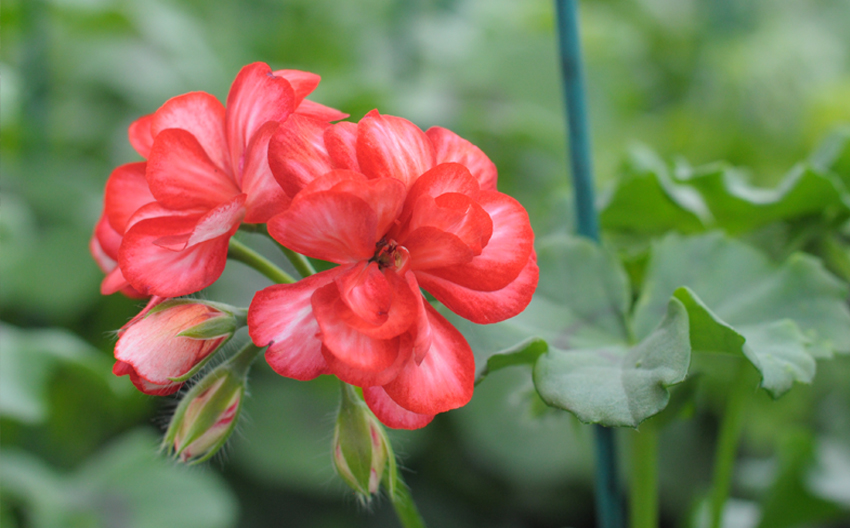
Image resolution: width=850 pixels, height=528 pixels. Identify the location of plant. (780, 175), (728, 296).